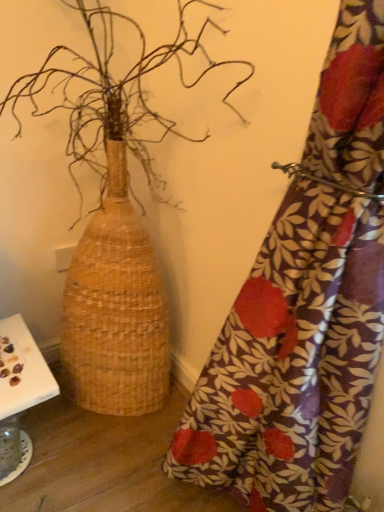
Question: Is floral fabric curtain at right in front of or behind natural woven basket at left in the image?

Choices:
 (A) front
 (B) behind

Answer: (A)

Question: Is floral fabric curtain at right taller or shorter than natural woven basket at left?

Choices:
 (A) short
 (B) tall

Answer: (A)

Question: Which object is the closest to the white paper at lower left?

Choices:
 (A) natural woven basket at left
 (B) floral fabric curtain at right

Answer: (A)

Question: Which of these objects is positioned closest to the floral fabric curtain at right?

Choices:
 (A) white paper at lower left
 (B) natural woven basket at left

Answer: (B)